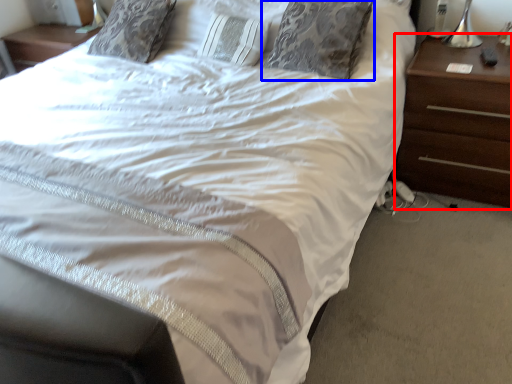
Question: Which point is closer to the camera, nightstand (highlighted by a red box) or pillow (highlighted by a blue box)?

Choices:
 (A) nightstand
 (B) pillow

Answer: (A)